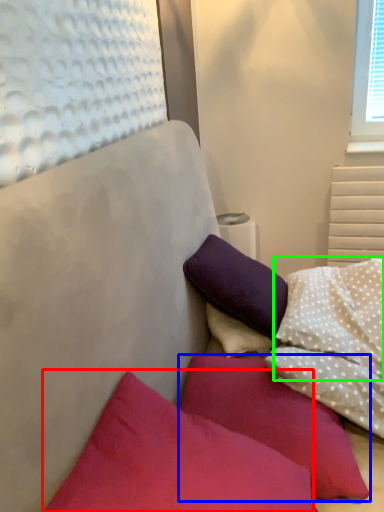
Question: Considering the real-world distances, which object is farthest from pillow (highlighted by a red box)? pillow (highlighted by a blue box) or pillow (highlighted by a green box)?

Choices:
 (A) pillow
 (B) pillow

Answer: (B)